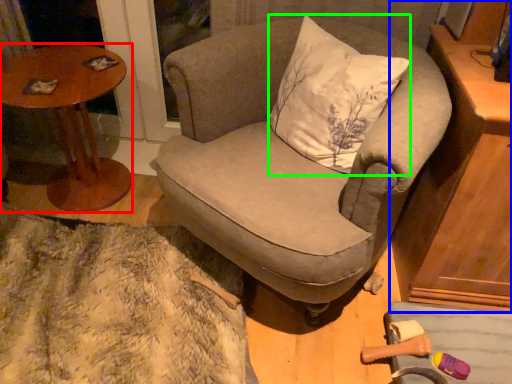
Question: Estimate the real-world distances between objects in this image. Which object is closer to table (highlighted by a red box), cabinetry (highlighted by a blue box) or pillow (highlighted by a green box)?

Choices:
 (A) cabinetry
 (B) pillow

Answer: (B)